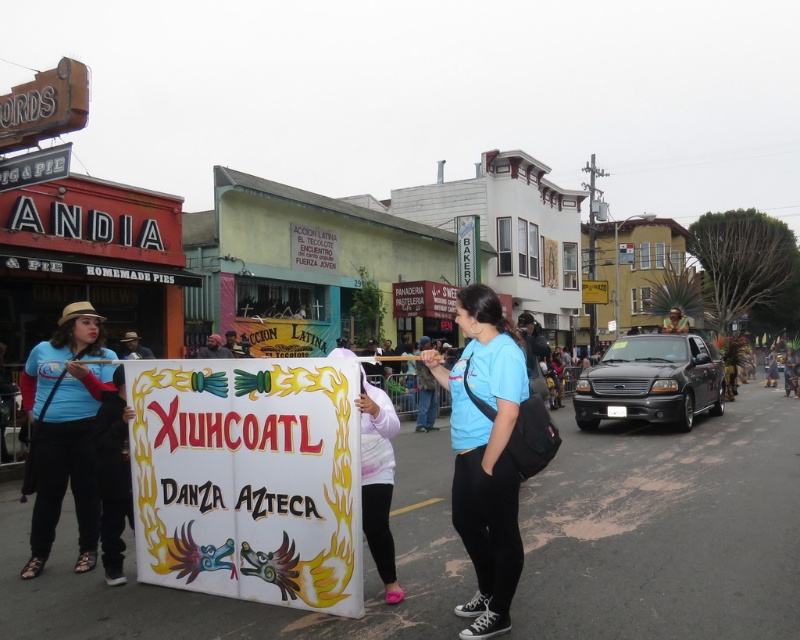
Question: Can you confirm if white fabric sign at center is wider than matte blue shirt at left?

Choices:
 (A) yes
 (B) no

Answer: (A)

Question: Which of these objects is positioned farthest from the white fabric sign at center?

Choices:
 (A) white matte sign at center
 (B) matte blue shirt at left

Answer: (B)

Question: Where is blue t-shirt at center located in relation to matte blue shirt at left in the image?

Choices:
 (A) right
 (B) left

Answer: (A)

Question: Which object is positioned closest to the white fabric sign at center?

Choices:
 (A) matte blue shirt at left
 (B) white matte sign at center

Answer: (B)

Question: Is blue t-shirt at center positioned at the back of white matte sign at center?

Choices:
 (A) no
 (B) yes

Answer: (A)

Question: Which of the following is the closest to the observer?

Choices:
 (A) (486, 557)
 (B) (381, 388)
 (C) (278, 445)

Answer: (A)